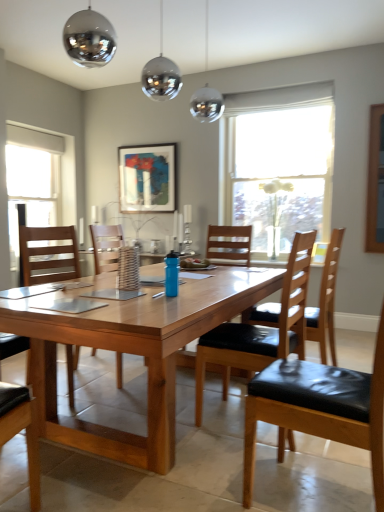
Identify the location of vacant space situated above clear glass vase at center, placed as the first window when sorted from right to left (from a real-world perspective). The width and height of the screenshot is (384, 512). (284, 111).